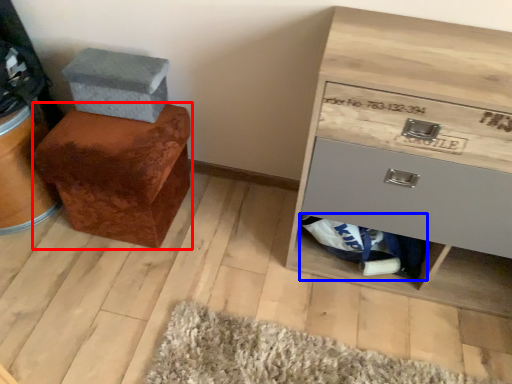
Question: Which of the following is the farthest to the observer, furniture (highlighted by a red box) or material (highlighted by a blue box)?

Choices:
 (A) furniture
 (B) material

Answer: (B)